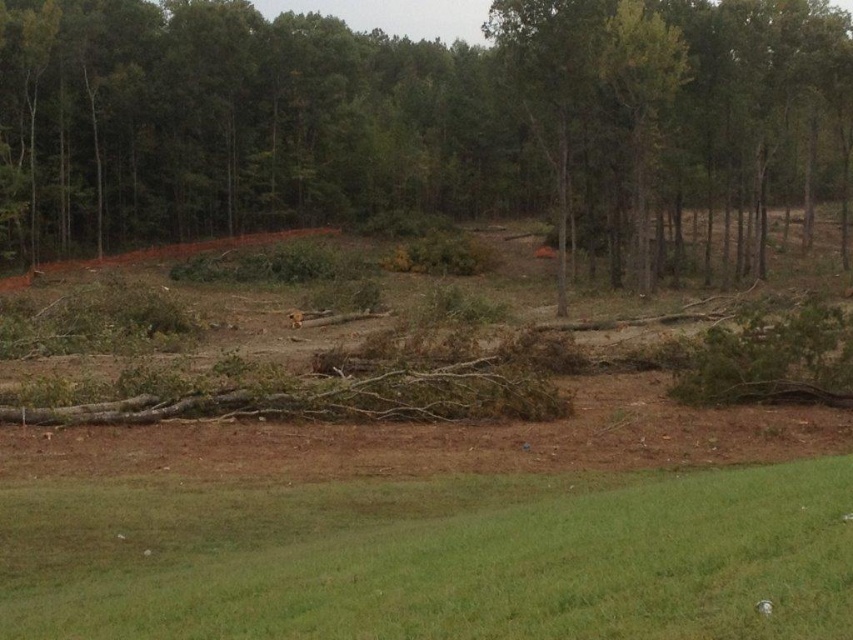
You are standing at the point marked as point (425, 125) in the forest clearing. What surface are you currently standing on?

You are standing on the brown wood log at center, as the point (425, 125) is located on it.

You are a park ranger assessing the cleared area. You notice the brown wood log at center and the green grass at lower center. Which object occupies more space in the scene?

The brown wood log at center has a larger size compared to green grass at lower center, so it occupies more space in the scene.

You are a hiker trying to cross the forest area and see the brown wood log at center blocking your path. There is also green grass at lower center nearby. Which direction should you move to avoid the log and stay on the grass?

You should move behind the brown wood log at center because the green grass at lower center is located behind it, allowing you to stay on the grass while avoiding the log.